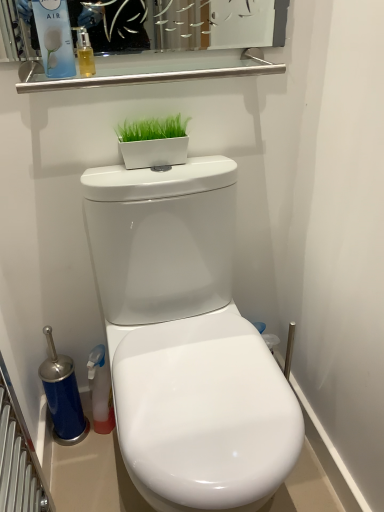
Identify the location of free space above satin nickel bar at upper center (from a real-world perspective). (161, 67).